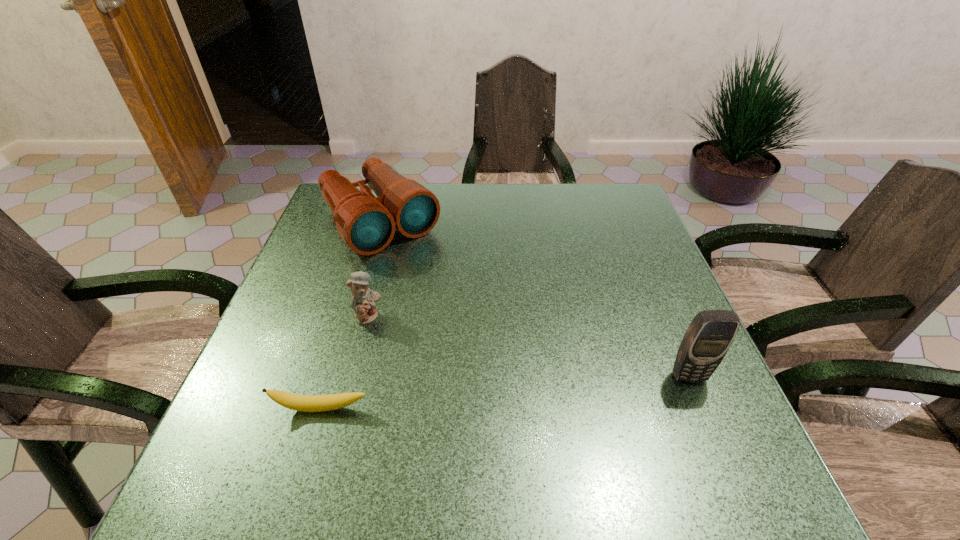
Locate an element on the screen. Image resolution: width=960 pixels, height=540 pixels. free spot between the nearest object and the binoculars is located at coordinates (350, 315).

Where is `vacant space that's between the binoculars and the banana`? vacant space that's between the binoculars and the banana is located at coordinates (x=350, y=315).

You are a GUI agent. You are given a task and a screenshot of the screen. Output one action in this format:
    pyautogui.click(x=<x>, y=<y>)
    Task: Click on the free space between the third shortest object and the third tallest object
    The image size is (960, 540).
    Given the screenshot: What is the action you would take?
    pyautogui.click(x=374, y=269)

This screenshot has height=540, width=960. Identify the location of free space between the third shortest object and the second farthest object. (374, 269).

Where is `vacant area that lies between the tallest object and the farthest object`? Image resolution: width=960 pixels, height=540 pixels. vacant area that lies between the tallest object and the farthest object is located at coordinates (535, 299).

At what (x,y) coordinates should I click in order to perform the action: click on empty space between the nearest object and the cellular telephone. Please return your answer as a coordinate pair (x, y). Image resolution: width=960 pixels, height=540 pixels. Looking at the image, I should click on click(x=505, y=393).

At what (x,y) coordinates should I click in order to perform the action: click on free space that is in between the binoculars and the tallest object. Please return your answer as a coordinate pair (x, y). The image size is (960, 540). Looking at the image, I should click on (535, 299).

This screenshot has width=960, height=540. I want to click on object that stands as the third closest to the tallest object, so click(363, 300).

Select which object is the third closest to the rightmost object. Please provide its 2D coordinates. Your answer should be formatted as a tuple, i.e. [(x, y)], where the tuple contains the x and y coordinates of a point satisfying the conditions above.

[(363, 300)]

Locate an element on the screen. This screenshot has width=960, height=540. vacant space that satisfies the following two spatial constraints: 1. on the front side of the second shortest object; 2. on the left side of the second tallest object is located at coordinates (351, 317).